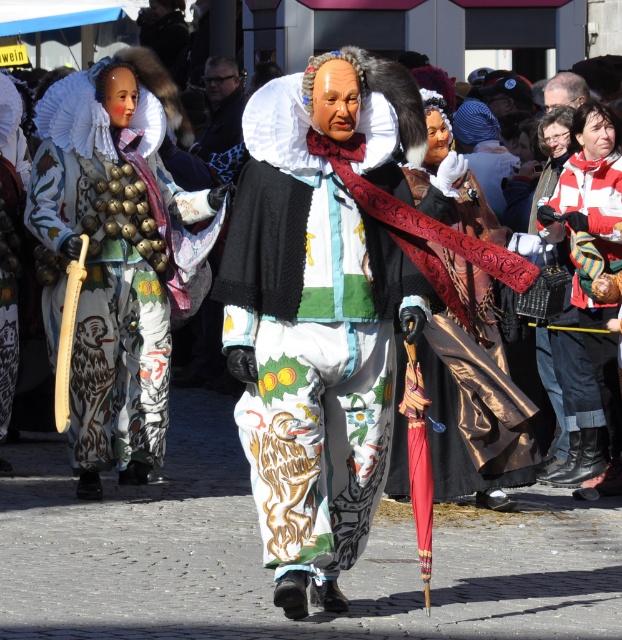
Question: Is the position of striped wool scarf at right less distant than that of smooth bald head at center?

Choices:
 (A) yes
 (B) no

Answer: (A)

Question: Is matte gold bells at left wider than striped wool scarf at right?

Choices:
 (A) no
 (B) yes

Answer: (B)

Question: Is matte gold bells at left to the left of dark gray fabric coat at center from the viewer's perspective?

Choices:
 (A) no
 (B) yes

Answer: (B)

Question: Based on their relative distances, which object is nearer to the dark gray fabric coat at center?

Choices:
 (A) matte gold bells at left
 (B) smooth bald head at center
 (C) matte white costume at center
 (D) carved wood sword at center

Answer: (B)

Question: Which object appears farthest from the camera in this image?

Choices:
 (A) matte white costume at center
 (B) dark gray fabric coat at center
 (C) striped wool scarf at right

Answer: (B)

Question: Which point is farther from the camera taking this photo?

Choices:
 (A) (457, 211)
 (B) (552, 81)
 (C) (95, 342)
 (D) (345, 48)

Answer: (D)